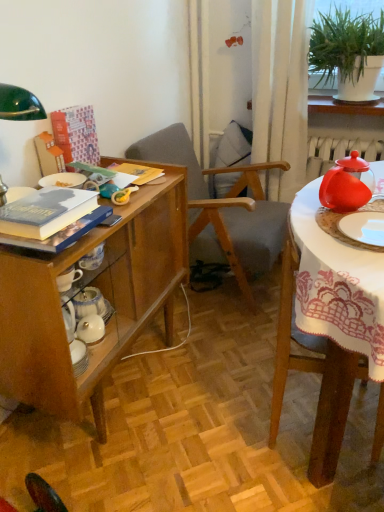
Identify the location of vacant space in between wooden desk at left and wooden chair at right, the second chair in the back-to-front sequence. (183, 410).